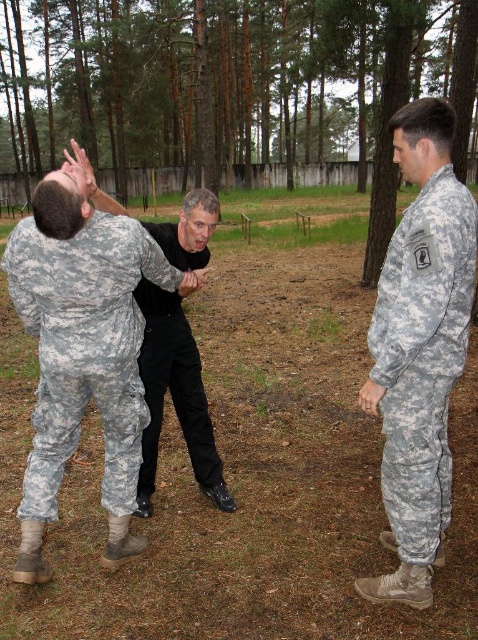
Which is in front, point (104, 353) or point (228, 497)?

Point (104, 353) is more forward.

Is camouflage fabric uniform at left bigger than black matte shirt at center?

Incorrect, camouflage fabric uniform at left is not larger than black matte shirt at center.

Between point (107, 499) and point (162, 381), which one is positioned in front?

Point (107, 499)

Locate an element on the screen. camouflage fabric uniform at left is located at coordinates (85, 348).

Is the position of camouflage fabric uniform at right more distant than that of black matte shirt at center?

No, it is in front of black matte shirt at center.

Does point (423, 186) come in front of point (149, 452)?

Yes, it is in front of point (149, 452).

Does point (456, 300) lie in front of point (212, 448)?

Yes, point (456, 300) is in front of point (212, 448).

Locate an element on the screen. The height and width of the screenshot is (640, 478). camouflage fabric uniform at right is located at coordinates (423, 356).

Does camouflage fabric uniform at right appear under black matte pants at center?

Yes, camouflage fabric uniform at right is below black matte pants at center.

How distant is camouflage fabric uniform at right from black matte pants at center?

camouflage fabric uniform at right is 1.21 meters away from black matte pants at center.

What do you see at coordinates (423, 356) in the screenshot?
I see `camouflage fabric uniform at right` at bounding box center [423, 356].

Locate an element on the screen. camouflage fabric uniform at right is located at coordinates (423, 356).